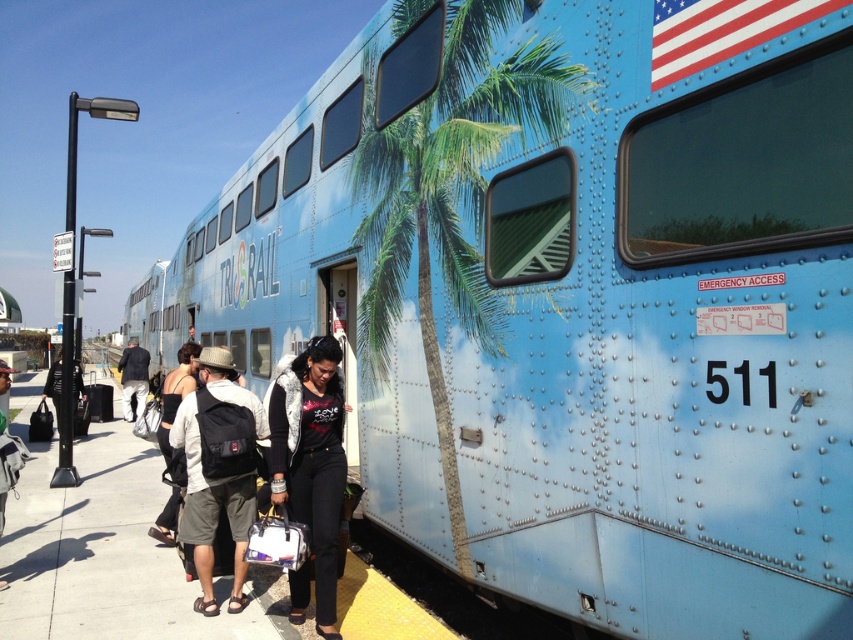
Which is below, black fabric backpack at center or denim jacket at lower left?

black fabric backpack at center

Who is positioned more to the right, black fabric backpack at center or denim jacket at lower left?

From the viewer's perspective, black fabric backpack at center appears more on the right side.

Who is more forward, [213,408] or [3,429]?

Point [213,408] is more forward.

You are a GUI agent. You are given a task and a screenshot of the screen. Output one action in this format:
    pyautogui.click(x=<x>, y=<y>)
    Task: Click on the black fabric backpack at center
    The height and width of the screenshot is (640, 853).
    Given the screenshot: What is the action you would take?
    pyautogui.click(x=218, y=468)

From the picture: Can you confirm if green leafy palm tree at center is shorter than denim jacket at lower left?

No, green leafy palm tree at center is not shorter than denim jacket at lower left.

Find the location of `green leafy palm tree at center`. green leafy palm tree at center is located at coordinates (450, 196).

In the scene shown: Who is higher up, denim jacket at lower left or dark blue jeans at center?

Positioned higher is denim jacket at lower left.

Does denim jacket at lower left lie in front of dark blue jeans at center?

Yes, it is in front of dark blue jeans at center.

Which is behind, point (9, 445) or point (137, 348)?

The point (137, 348) is behind.

The height and width of the screenshot is (640, 853). What are the coordinates of `denim jacket at lower left` in the screenshot? It's located at (9, 464).